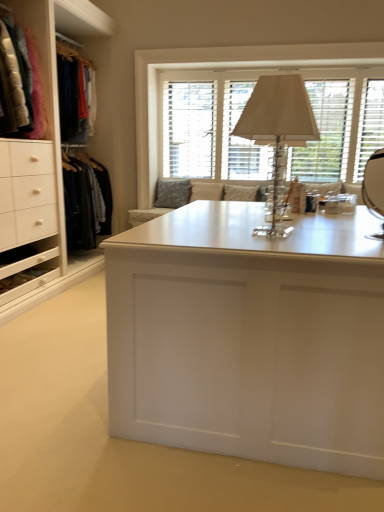
Question: From the image's perspective, is white matte desk at center positioned above or below textured gray pillow at center?

Choices:
 (A) below
 (B) above

Answer: (A)

Question: From their relative heights in the image, would you say white matte desk at center is taller or shorter than textured gray pillow at center?

Choices:
 (A) tall
 (B) short

Answer: (B)

Question: Based on their relative distances, which object is nearer to the textured gray pillow at center?

Choices:
 (A) white wood window at upper center
 (B) white matte desk at center
 (C) clear crystal table lamp at center
 (D) velvet jackets at left

Answer: (A)

Question: Estimate the real-world distances between objects in this image. Which object is closer to the textured gray pillow at center?

Choices:
 (A) clear crystal table lamp at center
 (B) velvet jackets at left
 (C) white wood window at upper center
 (D) white matte desk at center

Answer: (C)